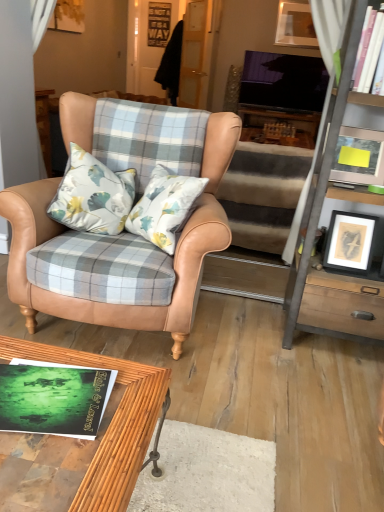
Locate an element on the screen. This screenshot has height=512, width=384. free space above green matte book at lower left (from a real-world perspective) is located at coordinates (57, 390).